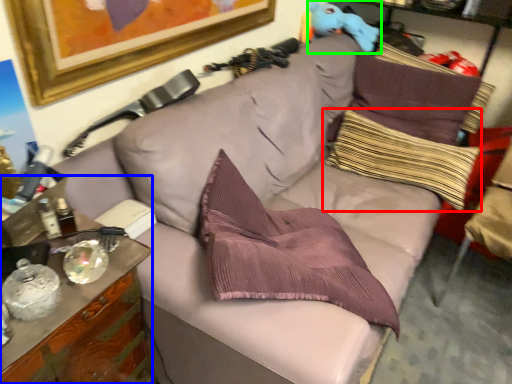
Question: Estimate the real-world distances between objects in this image. Which object is farther from pillow (highlighted by a red box), cabinetry (highlighted by a blue box) or toy (highlighted by a green box)?

Choices:
 (A) cabinetry
 (B) toy

Answer: (A)